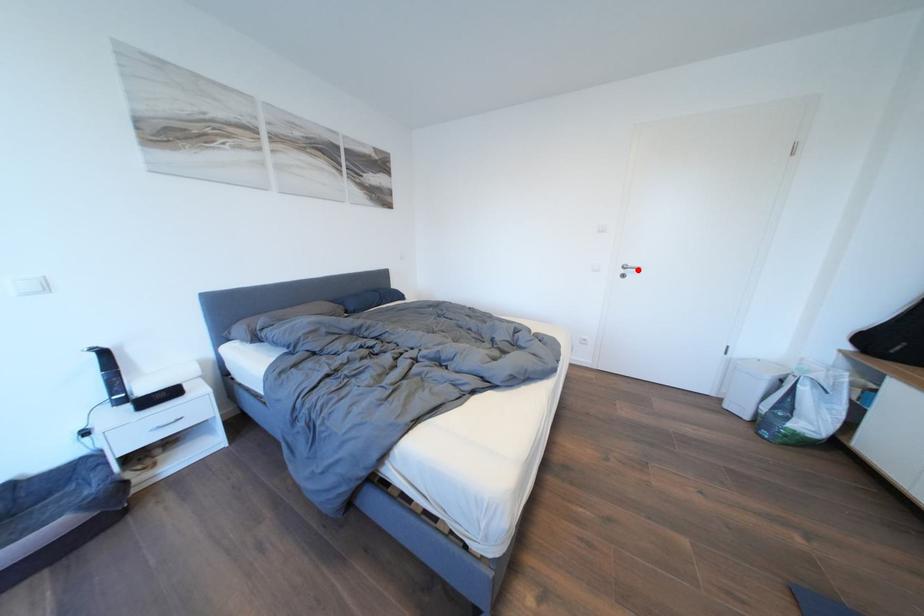
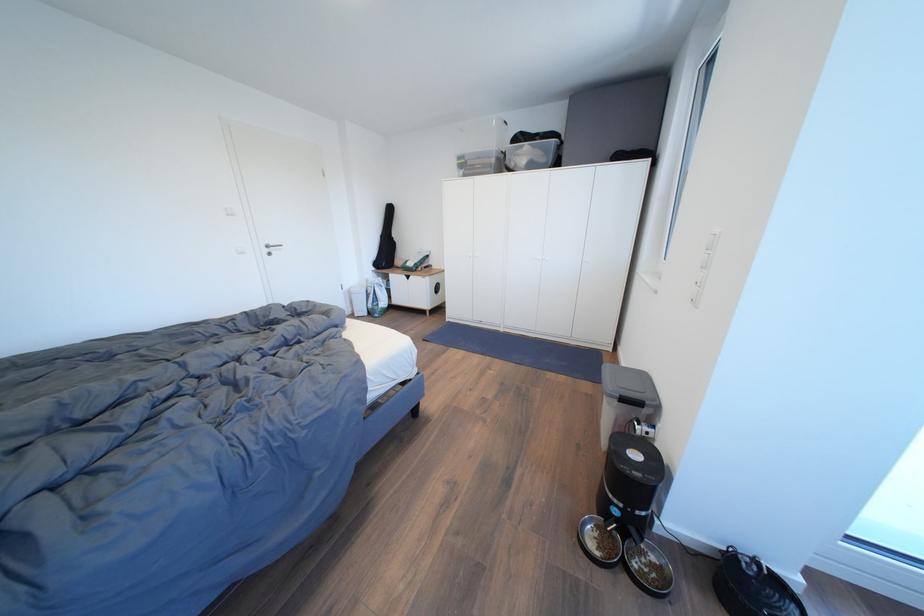
Locate, in the second image, the point that corresponds to the highlighted location in the first image.

(280, 249)